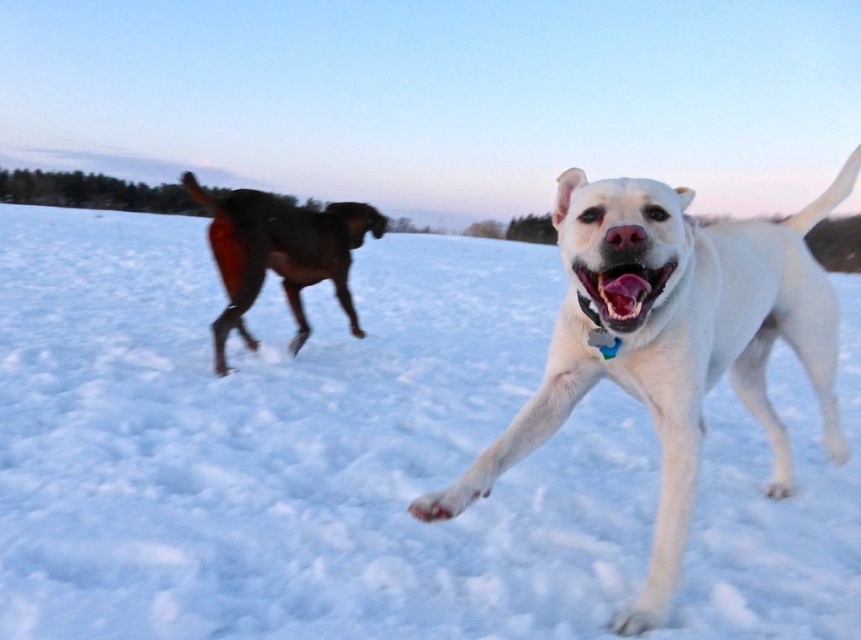
Who is shorter, white fluffy snow at center or white glossy dog at center?

With less height is white glossy dog at center.

Which is more to the right, white fluffy snow at center or white glossy dog at center?

white glossy dog at center is more to the right.

Who is more distant from viewer, (647, 500) or (611, 340)?

The point (647, 500) is behind.

The height and width of the screenshot is (640, 861). In order to click on white fluffy snow at center in this screenshot , I will do tap(295, 445).

Which is below, white fluffy snow at center or shiny brown dog at left?

shiny brown dog at left

Is white fluffy snow at center shorter than shiny brown dog at left?

Incorrect, white fluffy snow at center's height does not fall short of shiny brown dog at left's.

Is point (404, 522) farther from camera compared to point (354, 317)?

No, (404, 522) is closer to viewer.

Identify the location of white fluffy snow at center. The width and height of the screenshot is (861, 640). (295, 445).

Does white glossy dog at center come in front of shiny brown dog at left?

Yes.

Where is `white glossy dog at center`? white glossy dog at center is located at coordinates (672, 340).